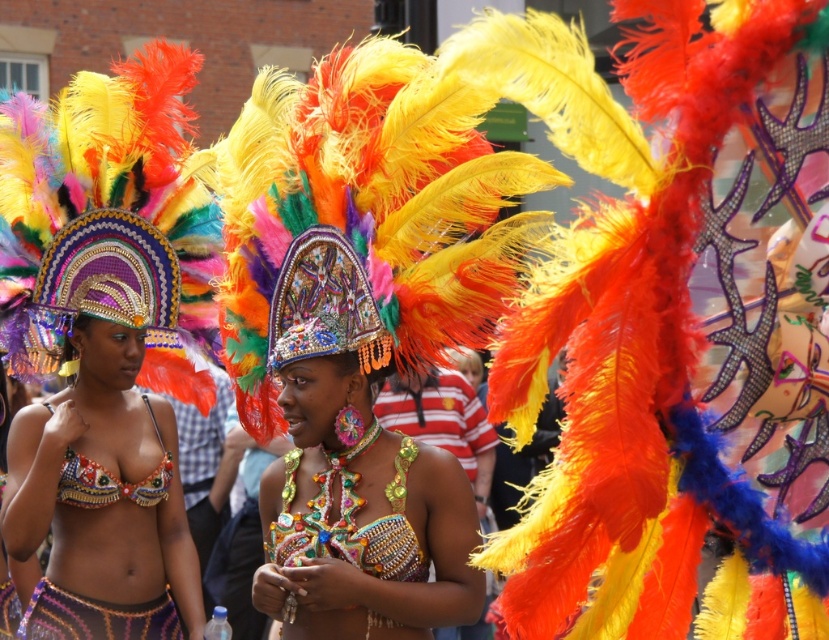
Question: Among these points, which one is farthest from the camera?

Choices:
 (A) tap(187, 573)
 (B) tap(90, 504)
 (C) tap(167, 253)
 (D) tap(313, 410)

Answer: (A)

Question: Observing the image, what is the correct spatial positioning of multicolored sequined bikini top at center in reference to beige sequined bikini top at center?

Choices:
 (A) left
 (B) right

Answer: (B)

Question: Considering the relative positions of multicolored sequined headdress at center and beige sequined bikini top at center in the image provided, where is multicolored sequined headdress at center located with respect to beige sequined bikini top at center?

Choices:
 (A) above
 (B) below

Answer: (A)

Question: Which point is closer to the camera?

Choices:
 (A) multicolored sequined bikini top at center
 (B) beige sequined bikini top at center
 (C) multicolored sequined headdress at center
 (D) shiny sequined costume at center

Answer: (D)

Question: Is multicolored sequined headdress at center wider than multicolored sequined bikini top at center?

Choices:
 (A) no
 (B) yes

Answer: (B)

Question: Which point is farther to the camera?

Choices:
 (A) (362, 525)
 (B) (120, 156)

Answer: (B)